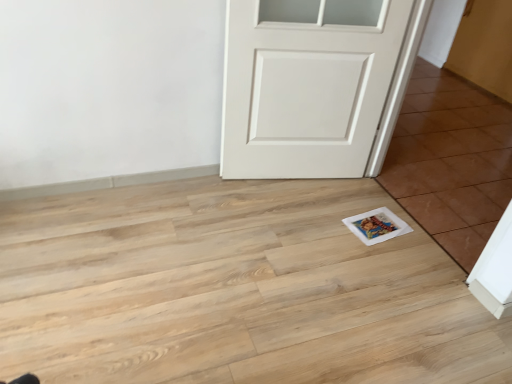
Question: Would you say white painted wood door at center is part of white glossy tile at lower right's contents?

Choices:
 (A) no
 (B) yes

Answer: (A)

Question: Could you tell me if white glossy tile at lower right is facing white painted wood door at center?

Choices:
 (A) yes
 (B) no

Answer: (A)

Question: Is white glossy tile at lower right next to white painted wood door at center?

Choices:
 (A) yes
 (B) no

Answer: (B)

Question: Does white glossy tile at lower right have a lesser height compared to white painted wood door at center?

Choices:
 (A) no
 (B) yes

Answer: (B)

Question: From the image's perspective, would you say white glossy tile at lower right is shown under white painted wood door at center?

Choices:
 (A) yes
 (B) no

Answer: (A)

Question: Does white glossy tile at lower right come in front of white painted wood door at center?

Choices:
 (A) no
 (B) yes

Answer: (B)

Question: Is white painted wood door at center positioned beyond the bounds of white glossy tile at lower right?

Choices:
 (A) no
 (B) yes

Answer: (B)

Question: Is white painted wood door at center smaller than white glossy tile at lower right?

Choices:
 (A) yes
 (B) no

Answer: (B)

Question: Are white painted wood door at center and white glossy tile at lower right making contact?

Choices:
 (A) no
 (B) yes

Answer: (A)

Question: From the image's perspective, is white painted wood door at center on top of white glossy tile at lower right?

Choices:
 (A) yes
 (B) no

Answer: (A)

Question: Does white painted wood door at center have a greater width compared to white glossy tile at lower right?

Choices:
 (A) yes
 (B) no

Answer: (A)

Question: Can you confirm if white painted wood door at center is thinner than white glossy tile at lower right?

Choices:
 (A) yes
 (B) no

Answer: (B)

Question: Looking at their shapes, would you say white painted wood door at center is wider or thinner than white glossy tile at lower right?

Choices:
 (A) thin
 (B) wide

Answer: (B)